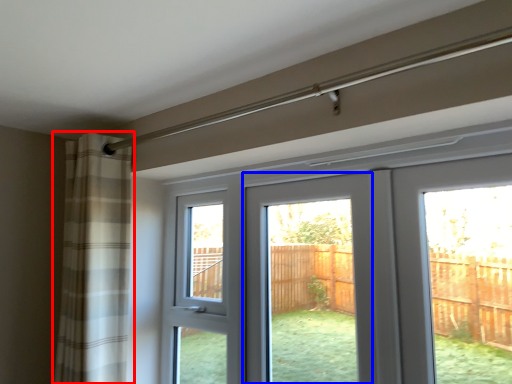
Question: Which of the following is the farthest to the observer, curtain (highlighted by a red box) or screen door (highlighted by a blue box)?

Choices:
 (A) curtain
 (B) screen door

Answer: (A)